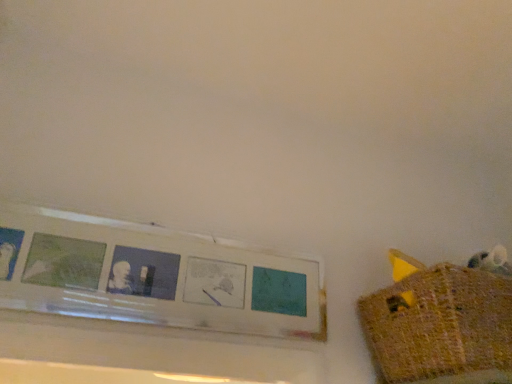
What do you see at coordinates (153, 276) in the screenshot? This screenshot has height=384, width=512. I see `white matte picture frame at upper left` at bounding box center [153, 276].

This screenshot has height=384, width=512. Identify the location of white matte picture frame at upper left. [x=153, y=276].

This screenshot has width=512, height=384. Find the location of `knitted yellow basket at right`. knitted yellow basket at right is located at coordinates (439, 324).

Based on the photo, measure the distance between point [422,348] and camera.

They are 34.76 inches apart.

Describe the element at coordinates (439, 324) in the screenshot. The width and height of the screenshot is (512, 384). I see `knitted yellow basket at right` at that location.

Locate an element on the screen. white matte picture frame at upper left is located at coordinates (153, 276).

Considering the positions of objects knitted yellow basket at right and white matte picture frame at upper left in the image provided, who is more to the left, knitted yellow basket at right or white matte picture frame at upper left?

white matte picture frame at upper left.

Which object is more forward, knitted yellow basket at right or white matte picture frame at upper left?

knitted yellow basket at right is more forward.

Considering the points (423, 310) and (141, 234), which point is in front, point (423, 310) or point (141, 234)?

The point (423, 310) is closer to the camera.

From the image's perspective, is knitted yellow basket at right on white matte picture frame at upper left?

No, from the image's perspective, knitted yellow basket at right is not on top of white matte picture frame at upper left.

From a real-world perspective, is knitted yellow basket at right positioned under white matte picture frame at upper left based on gravity?

Yes, from a real-world perspective, knitted yellow basket at right is below white matte picture frame at upper left.

Can you confirm if knitted yellow basket at right is thinner than white matte picture frame at upper left?

No.

Can you confirm if knitted yellow basket at right is shorter than white matte picture frame at upper left?

Correct, knitted yellow basket at right is not as tall as white matte picture frame at upper left.

Can you confirm if knitted yellow basket at right is bigger than white matte picture frame at upper left?

Correct, knitted yellow basket at right is larger in size than white matte picture frame at upper left.

Is knitted yellow basket at right inside or outside of white matte picture frame at upper left?

knitted yellow basket at right is outside white matte picture frame at upper left.

Is knitted yellow basket at right far from white matte picture frame at upper left?

They are positioned close to each other.

Is knitted yellow basket at right facing towards white matte picture frame at upper left?

No, knitted yellow basket at right is not aimed at white matte picture frame at upper left.

What's the angular difference between knitted yellow basket at right and white matte picture frame at upper left's facing directions?

0.537 degrees separate the facing orientations of knitted yellow basket at right and white matte picture frame at upper left.

The height and width of the screenshot is (384, 512). What are the coordinates of `picture frame that appears behind the knitted yellow basket at right` in the screenshot? It's located at (153, 276).

Does white matte picture frame at upper left appear on the right side of knitted yellow basket at right?

Incorrect, white matte picture frame at upper left is not on the right side of knitted yellow basket at right.

Is white matte picture frame at upper left positioned behind knitted yellow basket at right?

Yes, it is.

Which point is more distant from viewer, (206, 266) or (464, 275)?

The point (206, 266) is farther from the camera.

From the image's perspective, is white matte picture frame at upper left located beneath knitted yellow basket at right?

Actually, white matte picture frame at upper left appears above knitted yellow basket at right in the image.

From a real-world perspective, is white matte picture frame at upper left physically below knitted yellow basket at right?

No, from a real-world perspective, white matte picture frame at upper left is not under knitted yellow basket at right.

From the picture: Which of these two, white matte picture frame at upper left or knitted yellow basket at right, is wider?

knitted yellow basket at right.

From the picture: Does white matte picture frame at upper left have a greater height compared to knitted yellow basket at right?

Yes.

Considering the relative sizes of white matte picture frame at upper left and knitted yellow basket at right in the image provided, is white matte picture frame at upper left bigger than knitted yellow basket at right?

No, white matte picture frame at upper left is not bigger than knitted yellow basket at right.

Is white matte picture frame at upper left inside or outside of knitted yellow basket at right?

white matte picture frame at upper left is outside knitted yellow basket at right.

Is white matte picture frame at upper left positioned far away from knitted yellow basket at right?

white matte picture frame at upper left is near knitted yellow basket at right, not far away.

Could you tell me if white matte picture frame at upper left is turned towards knitted yellow basket at right?

No, white matte picture frame at upper left does not turn towards knitted yellow basket at right.

This screenshot has width=512, height=384. Identify the location of picture frame behind the knitted yellow basket at right. (153, 276).

This screenshot has width=512, height=384. What are the coordinates of `picture frame above the knitted yellow basket at right (from the image's perspective)` in the screenshot? It's located at (153, 276).

Where is `basket that is under the white matte picture frame at upper left (from a real-world perspective)`? This screenshot has height=384, width=512. basket that is under the white matte picture frame at upper left (from a real-world perspective) is located at coordinates (439, 324).